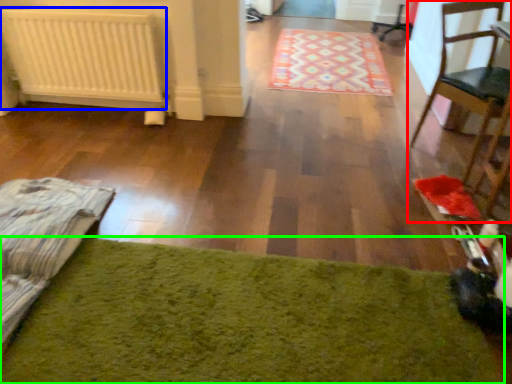
Question: Which object is the farthest from chair (highlighted by a red box)? Choose among these: radiator (highlighted by a blue box) or mat (highlighted by a green box).

Choices:
 (A) radiator
 (B) mat

Answer: (A)